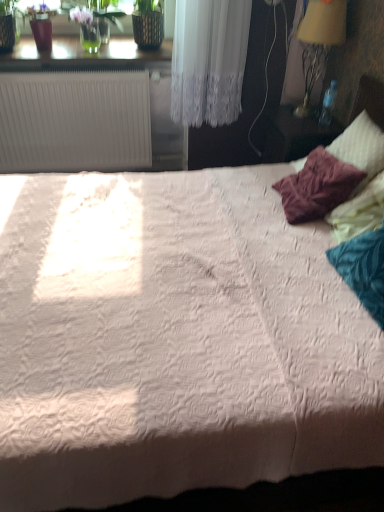
Question: Considering the positions of point (279, 109) and point (321, 16), is point (279, 109) closer or farther from the camera than point (321, 16)?

Choices:
 (A) farther
 (B) closer

Answer: (A)

Question: Considering the positions of matte wooden nightstand at right and yellow fabric lampshade at upper right in the image, is matte wooden nightstand at right bigger or smaller than yellow fabric lampshade at upper right?

Choices:
 (A) big
 (B) small

Answer: (A)

Question: Considering the real-world distances, which object is farthest from the matte wooden nightstand at right?

Choices:
 (A) yellow fabric lampshade at upper right
 (B) white plastic radiator at upper left

Answer: (B)

Question: Which of these objects is positioned farthest from the yellow fabric lampshade at upper right?

Choices:
 (A) white plastic radiator at upper left
 (B) matte wooden nightstand at right

Answer: (A)